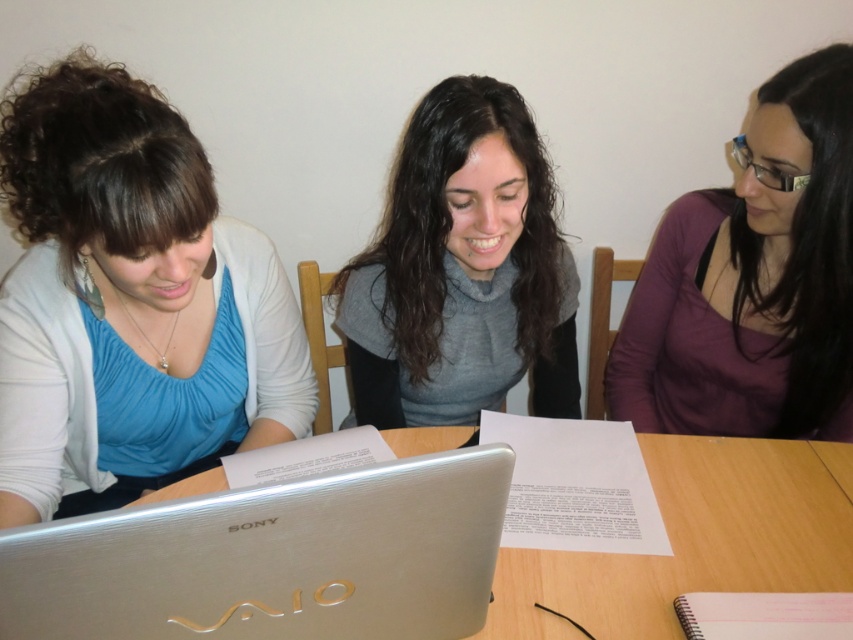
Question: Is matte blue blouse at left to the left of gray soft sweater at center from the viewer's perspective?

Choices:
 (A) no
 (B) yes

Answer: (B)

Question: Which point is closer to the camera?

Choices:
 (A) silver metallic laptop at center
 (B) gray soft sweater at center

Answer: (A)

Question: Is matte blue blouse at left below purple matte shirt at center?

Choices:
 (A) yes
 (B) no

Answer: (A)

Question: Is matte blue blouse at left thinner than purple matte shirt at center?

Choices:
 (A) yes
 (B) no

Answer: (B)

Question: Which object is closer to the camera taking this photo?

Choices:
 (A) gray soft sweater at center
 (B) silver metallic laptop at center
 (C) matte blue blouse at left
 (D) purple matte shirt at center

Answer: (B)

Question: Which object appears farthest from the camera in this image?

Choices:
 (A) gray soft sweater at center
 (B) purple matte shirt at center
 (C) matte blue blouse at left

Answer: (B)